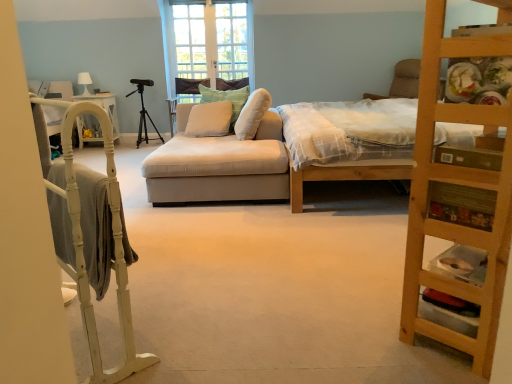
The image size is (512, 384). I want to click on empty space that is in between wooden ladder at right and white painted wood bunk bed at left, so click(x=267, y=326).